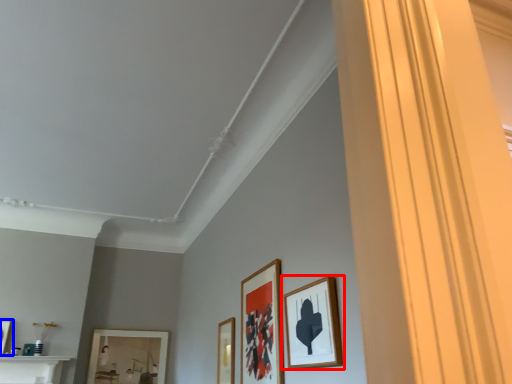
Question: Which object appears closest to the camera in this image, picture frame (highlighted by a red box) or picture frame (highlighted by a blue box)?

Choices:
 (A) picture frame
 (B) picture frame

Answer: (A)